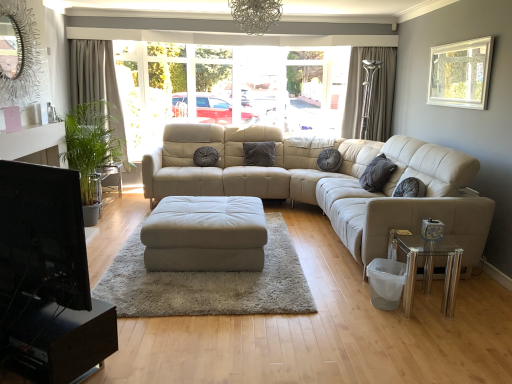
Question: Is metallic wire chandelier at upper center taller than white framed window at upper right?

Choices:
 (A) no
 (B) yes

Answer: (A)

Question: Is metallic wire chandelier at upper center further to camera compared to white framed window at upper right?

Choices:
 (A) yes
 (B) no

Answer: (B)

Question: Is metallic wire chandelier at upper center outside white framed window at upper right?

Choices:
 (A) no
 (B) yes

Answer: (B)

Question: From the image's perspective, is metallic wire chandelier at upper center beneath white framed window at upper right?

Choices:
 (A) no
 (B) yes

Answer: (A)

Question: Can you confirm if metallic wire chandelier at upper center is smaller than white framed window at upper right?

Choices:
 (A) yes
 (B) no

Answer: (B)

Question: From the image's perspective, is metallic wire chandelier at upper center over white framed window at upper right?

Choices:
 (A) yes
 (B) no

Answer: (A)

Question: Considering the relative sizes of white framed window at upper right and beige fabric curtain at left, placed as the second curtain when sorted from right to left, in the image provided, is white framed window at upper right thinner than beige fabric curtain at left, placed as the second curtain when sorted from right to left,?

Choices:
 (A) no
 (B) yes

Answer: (B)

Question: Is white framed window at upper right far from beige fabric curtain at left, which is counted as the 1th curtain, starting from the left?

Choices:
 (A) yes
 (B) no

Answer: (A)

Question: Does white framed window at upper right have a greater height compared to beige fabric curtain at left, placed as the second curtain when sorted from right to left?

Choices:
 (A) no
 (B) yes

Answer: (A)

Question: Is white framed window at upper right in front of beige fabric curtain at left, which is counted as the 1th curtain, starting from the left?

Choices:
 (A) no
 (B) yes

Answer: (B)

Question: Does white framed window at upper right have a smaller size compared to beige fabric curtain at left, placed as the second curtain when sorted from right to left?

Choices:
 (A) no
 (B) yes

Answer: (B)

Question: Does white framed window at upper right turn towards beige fabric curtain at left, which is counted as the 1th curtain, starting from the left?

Choices:
 (A) yes
 (B) no

Answer: (A)

Question: Is beige fabric curtain at left, placed as the second curtain when sorted from right to left, positioned before silky gray curtain at right, which is the 2th curtain in left-to-right order?

Choices:
 (A) yes
 (B) no

Answer: (A)